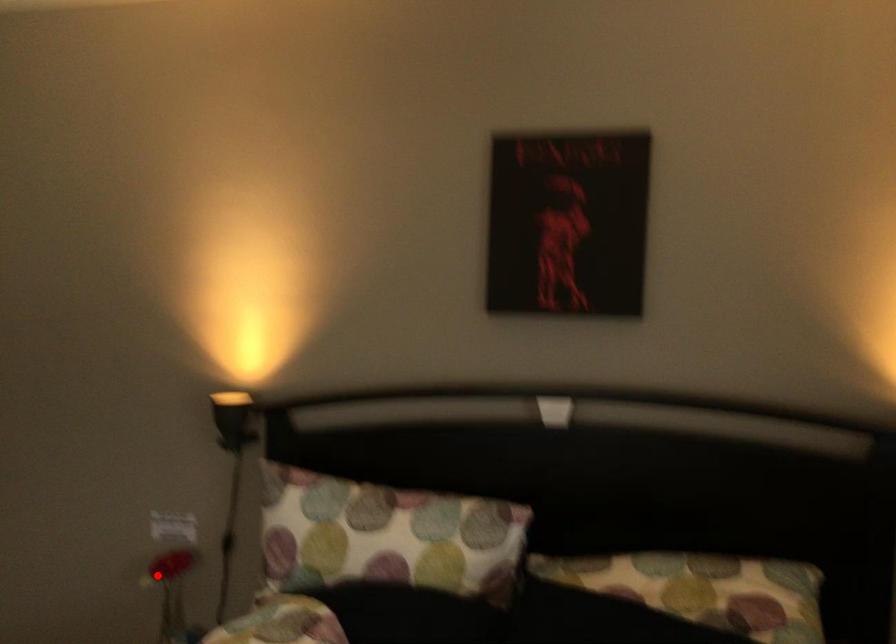
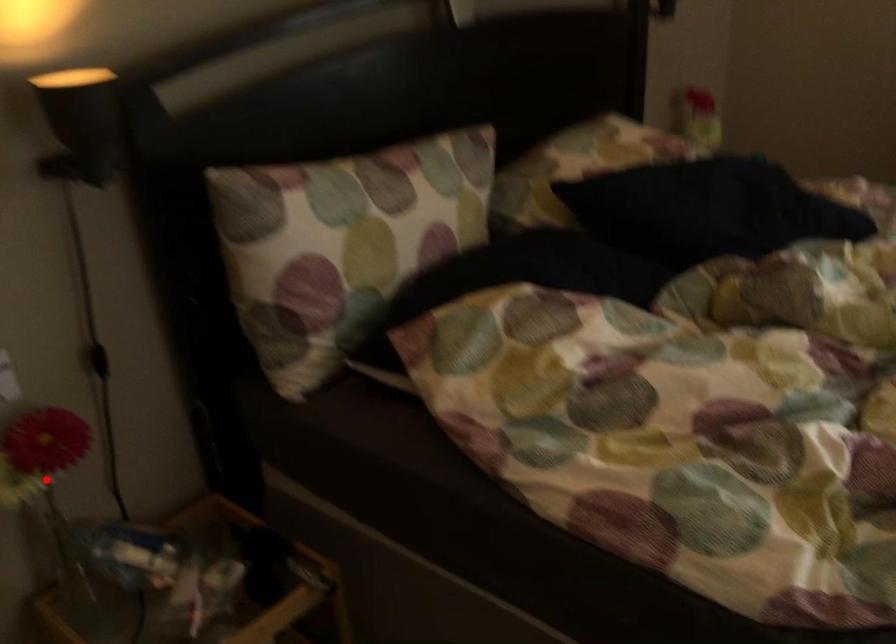
I am providing you with two images of the same scene from different viewpoints. A red point is marked on the first image and another point is marked on the second image. Does the point marked in image1 correspond to the same location as the one in image2?

Yes